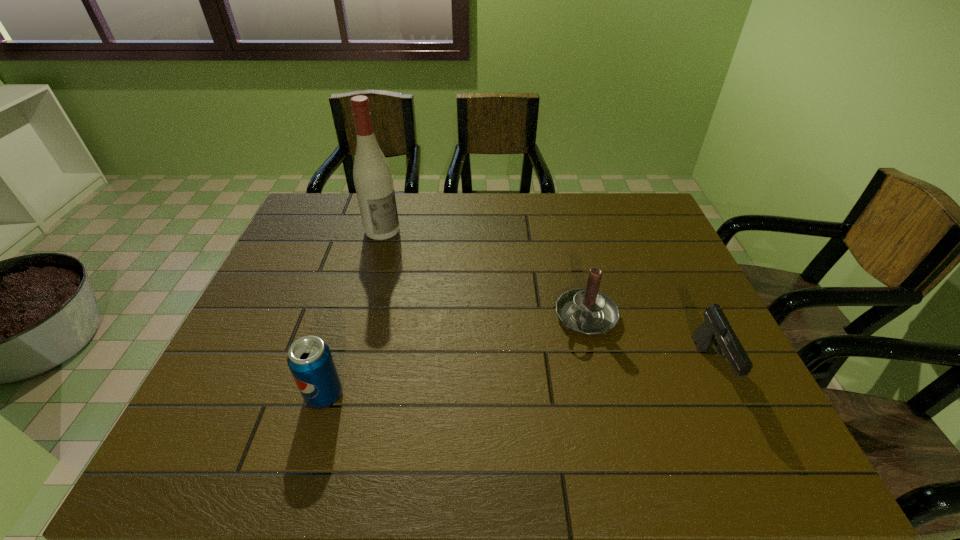
This screenshot has width=960, height=540. In order to click on vacant area situated 0.120m on the label of the alcohol in this screenshot , I will do `click(412, 258)`.

I want to click on free space located on the label of the alcohol, so click(454, 296).

Where is `vacant region located 0.280m on the label of the alcohol`? vacant region located 0.280m on the label of the alcohol is located at coordinates (444, 287).

Where is `object that is at the far edge`? The width and height of the screenshot is (960, 540). object that is at the far edge is located at coordinates (372, 175).

Identify the location of pop soda that is at the near edge. This screenshot has width=960, height=540. [x=310, y=360].

You are a GUI agent. You are given a task and a screenshot of the screen. Output one action in this format:
    pyautogui.click(x=<x>, y=<y>)
    Task: Click on the pistol that is at the near edge
    The image size is (960, 540).
    Given the screenshot: What is the action you would take?
    pyautogui.click(x=716, y=327)

Where is `object that is at the right edge`? object that is at the right edge is located at coordinates (716, 327).

This screenshot has width=960, height=540. Find the location of `object located at the near right corner`. object located at the near right corner is located at coordinates (716, 327).

I want to click on free space at the far edge, so click(473, 196).

I want to click on vacant region at the near edge of the desktop, so click(527, 414).